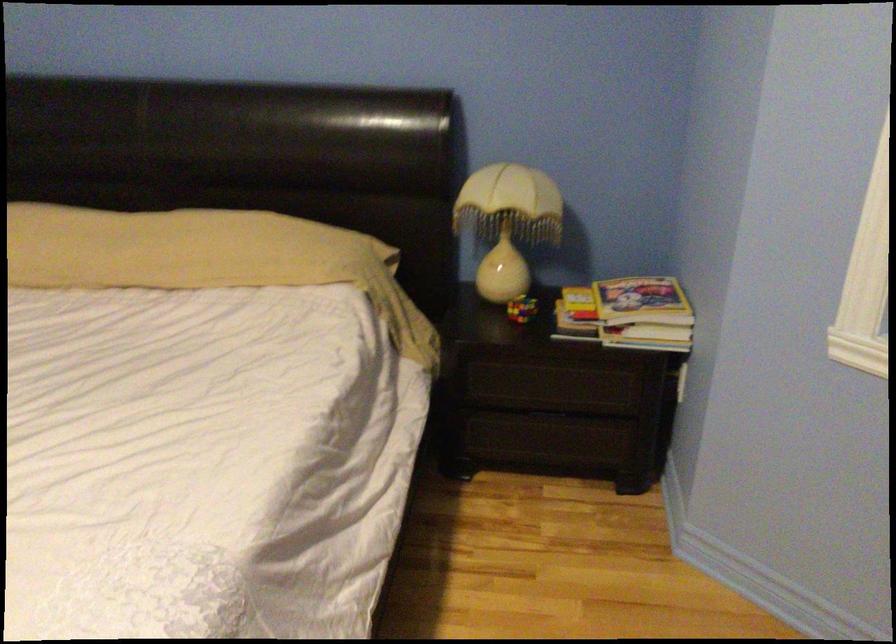
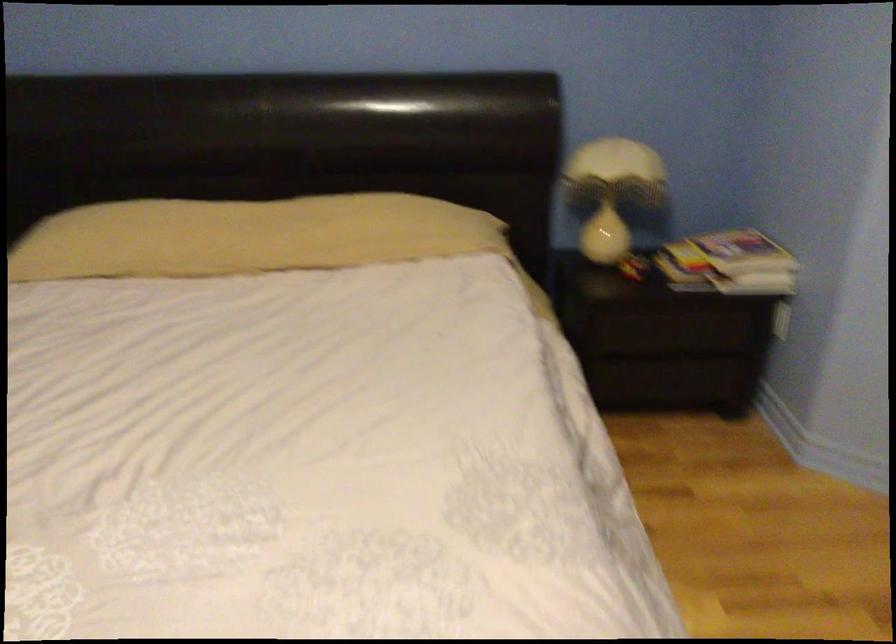
Question: In a continuous first-person perspective shot, in which direction is the camera moving?

Choices:
 (A) Left
 (B) Right
 (C) Forward
 (D) Backward

Answer: (A)